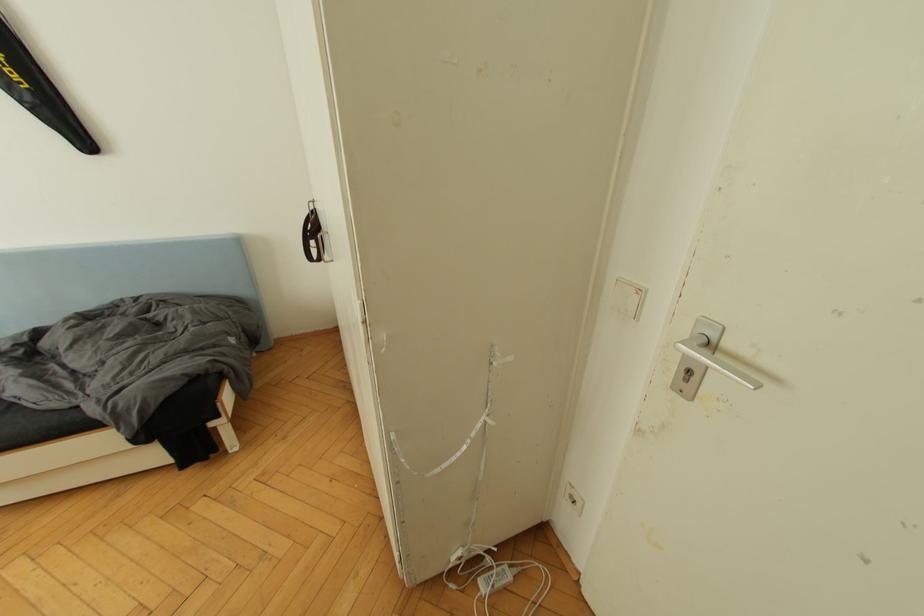
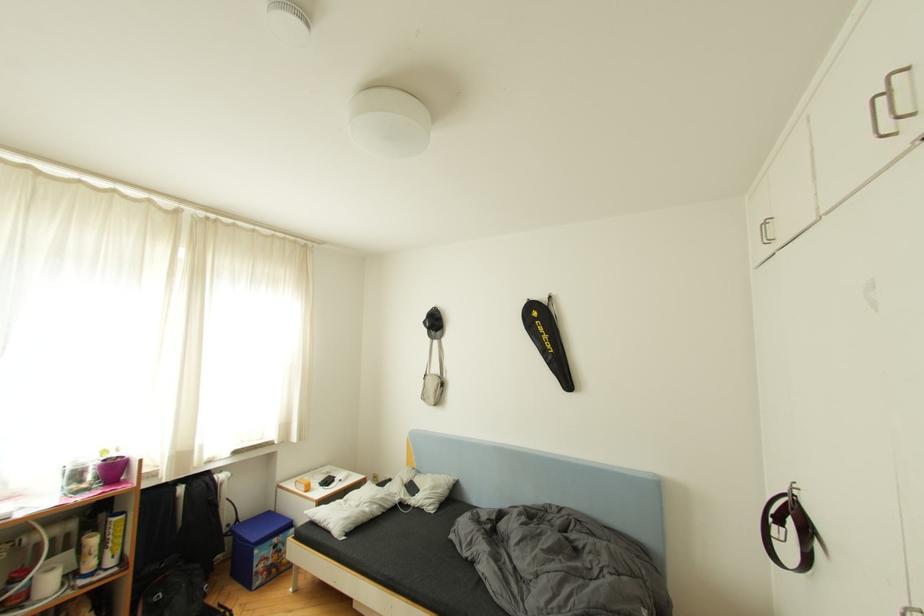
Based on the continuous images, in which direction is the camera rotating?

The rotation direction of the camera is left-up.